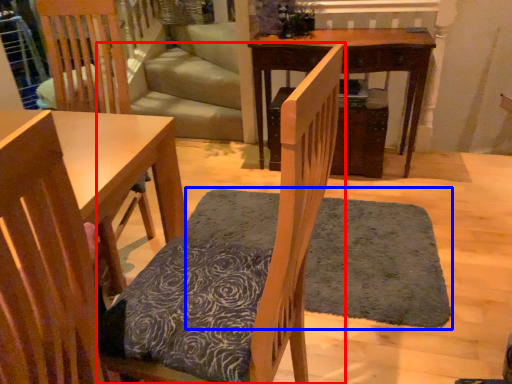
Question: Among these objects, which one is nearest to the camera, chair (highlighted by a red box) or doormat (highlighted by a blue box)?

Choices:
 (A) chair
 (B) doormat

Answer: (A)